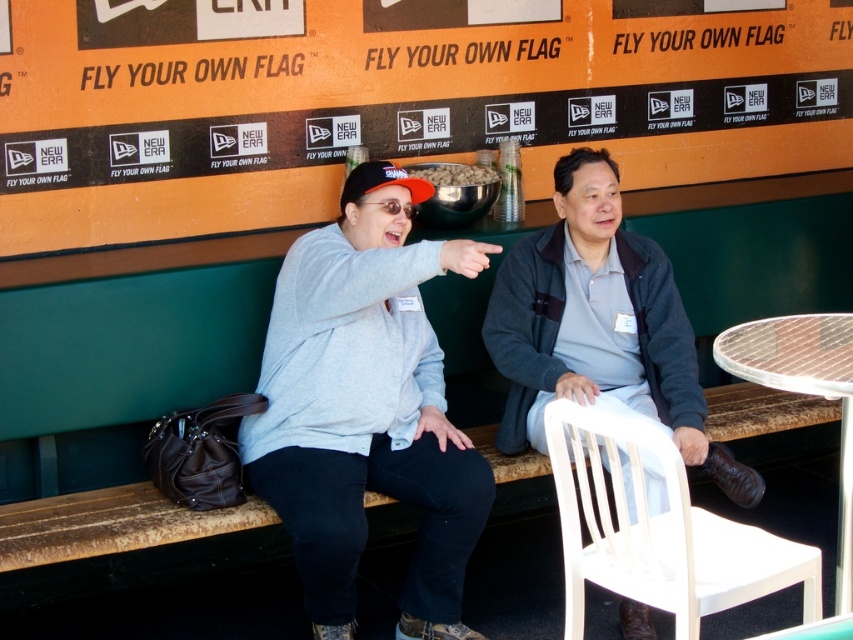
Question: Is matte gray sweatshirt at center thinner than clear plastic table at lower right?

Choices:
 (A) yes
 (B) no

Answer: (B)

Question: Which point appears farthest from the camera in this image?

Choices:
 (A) (773, 369)
 (B) (641, 440)
 (C) (132, 154)

Answer: (C)

Question: Can you confirm if matte gray sweatshirt at center is wider than white plastic chair at lower right?

Choices:
 (A) yes
 (B) no

Answer: (A)

Question: Which point appears closest to the camera in this image?

Choices:
 (A) (445, 448)
 (B) (836, 353)
 (C) (630, 317)

Answer: (B)

Question: Which point is closer to the camera?

Choices:
 (A) (585, 388)
 (B) (799, 328)
 (C) (334, 280)
 (D) (474, 84)

Answer: (B)

Question: Does matte gray sweatshirt at center appear on the left side of gray fleece jacket at center?

Choices:
 (A) no
 (B) yes

Answer: (B)